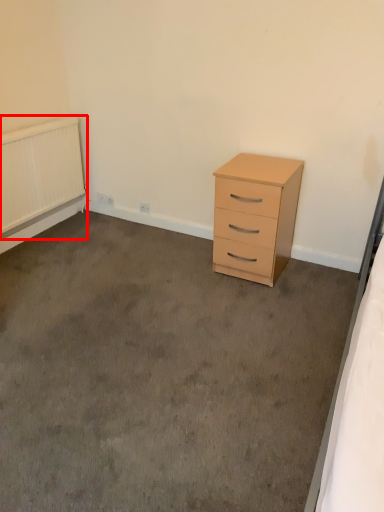
Question: Considering the relative positions of radiator (annotated by the red box) and chest of drawers in the image provided, where is radiator (annotated by the red box) located with respect to the staircase?

Choices:
 (A) left
 (B) right

Answer: (A)